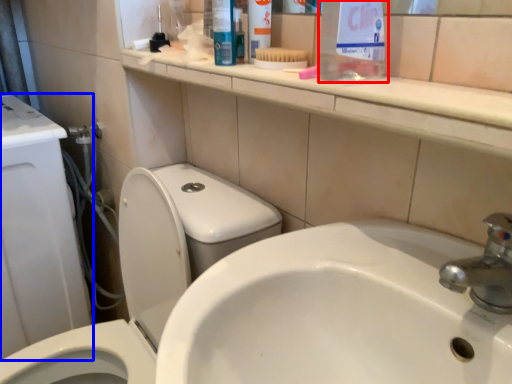
Question: Among these objects, which one is nearest to the camera, cleaning product (highlighted by a red box) or porcelain (highlighted by a blue box)?

Choices:
 (A) cleaning product
 (B) porcelain

Answer: (A)